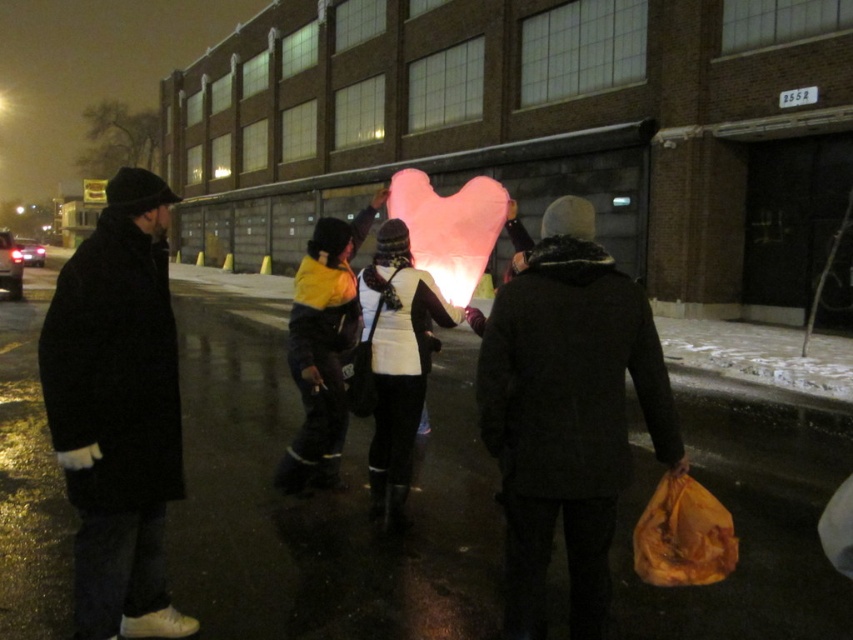
Does white matte vest at center appear under yellow and black jacket at center?

Indeed, white matte vest at center is positioned under yellow and black jacket at center.

How distant is white matte vest at center from yellow and black jacket at center?

white matte vest at center is 1.42 meters from yellow and black jacket at center.

Image resolution: width=853 pixels, height=640 pixels. In order to click on white matte vest at center in this screenshot , I will do `click(397, 362)`.

Image resolution: width=853 pixels, height=640 pixels. I want to click on white matte vest at center, so click(x=397, y=362).

Is black fuzzy coat at center positioned behind black wool coat at left?

No.

Between point (572, 541) and point (70, 454), which one is positioned in front?

Point (70, 454)

Is point (505, 529) closer to camera compared to point (128, 454)?

No, it is behind (128, 454).

Where is `black fuzzy coat at center`? This screenshot has height=640, width=853. black fuzzy coat at center is located at coordinates (567, 413).

Is point (123, 288) farther from camera compared to point (310, 236)?

That is False.

Between black wool coat at left and yellow and black jacket at center, which one appears on the left side from the viewer's perspective?

black wool coat at left is more to the left.

Between point (123, 422) and point (305, 364), which one is positioned behind?

Point (305, 364)

I want to click on black wool coat at left, so click(117, 410).